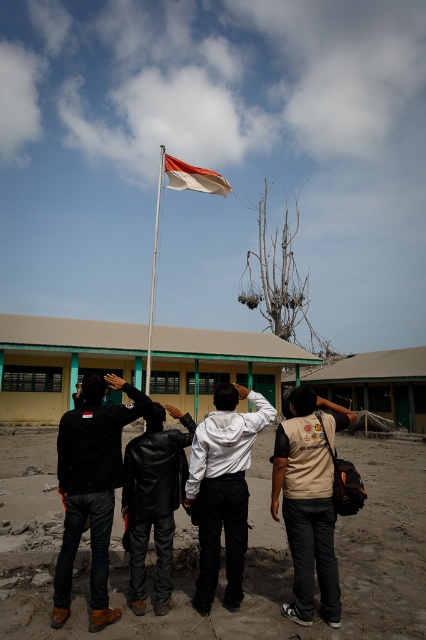
Question: Does black leather jacket at center come behind white fabric flag at upper center?

Choices:
 (A) no
 (B) yes

Answer: (A)

Question: Which point is closer to the camera?

Choices:
 (A) beige fabric shirt at center
 (B) black leather jacket at center
 (C) white fabric flag at upper center
 (D) white wooden flag pole at upper center

Answer: (A)

Question: Which object is the farthest from the white fabric flag at upper center?

Choices:
 (A) black leather jacket at center
 (B) beige fabric shirt at center
 (C) white wooden flag pole at upper center
 (D) white matte jacket at center

Answer: (C)

Question: Which of these objects is positioned farthest from the white wooden flag pole at upper center?

Choices:
 (A) black leather jacket at center
 (B) white fabric flag at upper center
 (C) beige fabric shirt at center

Answer: (B)

Question: Is beige fabric shirt at center above black leather jacket at center?

Choices:
 (A) yes
 (B) no

Answer: (A)

Question: Can you confirm if black leather jacket at left is wider than black leather jacket at center?

Choices:
 (A) yes
 (B) no

Answer: (A)